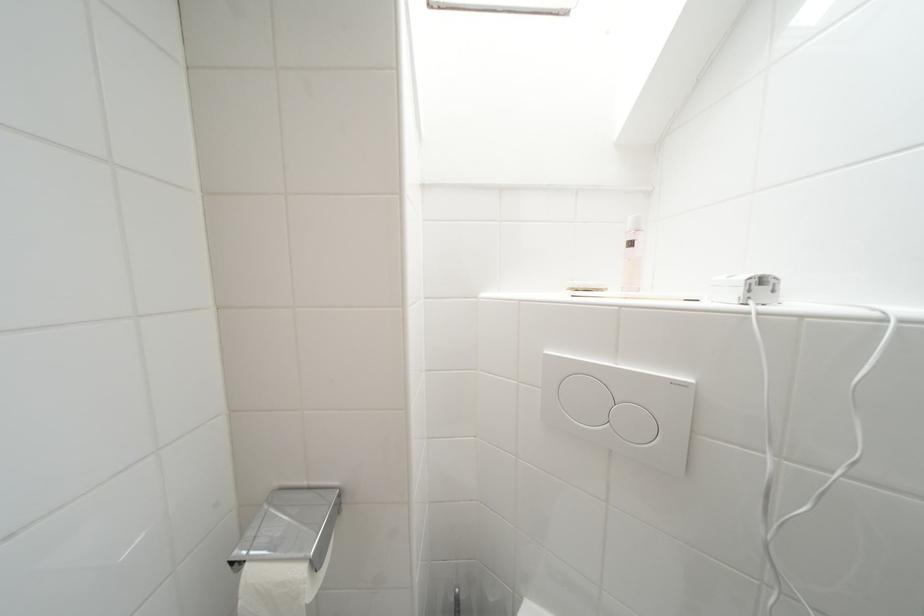
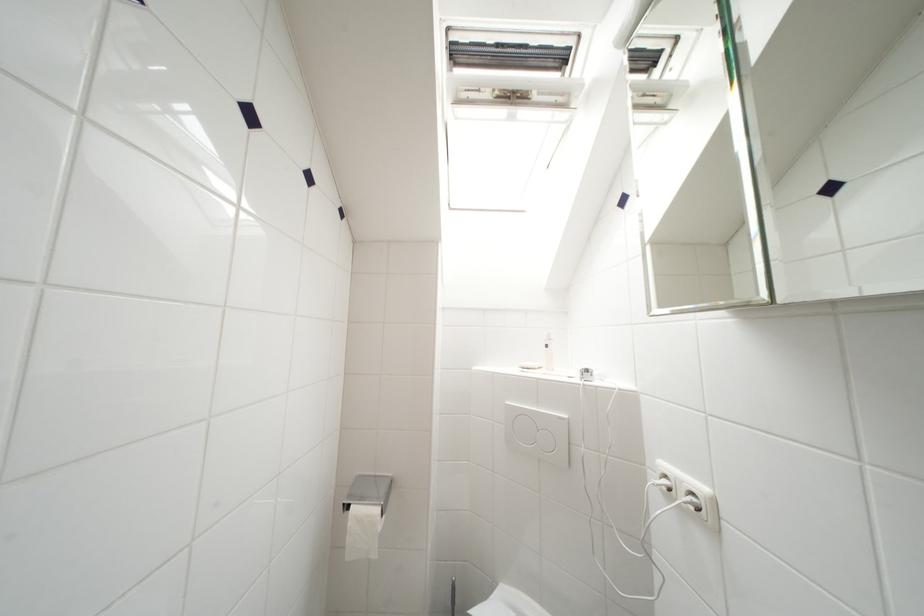
Where in the second image is the point corresponding to the point at 681,387 from the first image?

(565, 421)